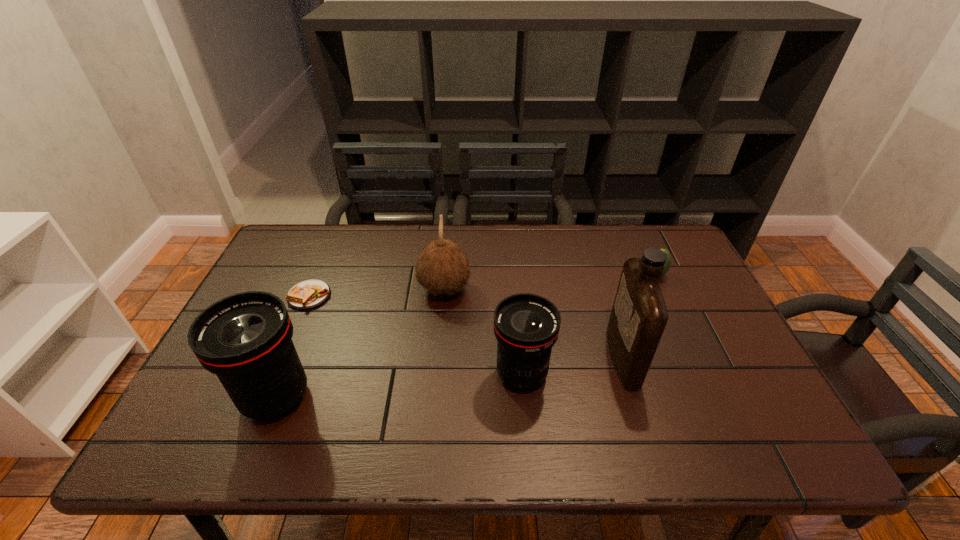
Image resolution: width=960 pixels, height=540 pixels. What are the coordinates of `the left telephoto lens` in the screenshot? It's located at (245, 339).

The height and width of the screenshot is (540, 960). I want to click on the shorter telephoto lens, so click(x=526, y=326).

I want to click on the right telephoto lens, so pos(526,326).

Locate an element on the screen. the fifth tallest object is located at coordinates (668, 262).

Where is `the rightmost object`? the rightmost object is located at coordinates (668, 262).

Find the location of a particular element. This screenshot has height=540, width=960. the shortest object is located at coordinates (308, 294).

Locate an element on the screen. This screenshot has width=960, height=540. the fourth object from right to left is located at coordinates (443, 267).

Where is `the fifth object from left to right`? This screenshot has height=540, width=960. the fifth object from left to right is located at coordinates (639, 315).

In order to click on the tallest object in this screenshot , I will do `click(639, 315)`.

This screenshot has height=540, width=960. What are the coordinates of `vacant space situated 0.080m on the back of the taller telephoto lens` in the screenshot? It's located at (299, 341).